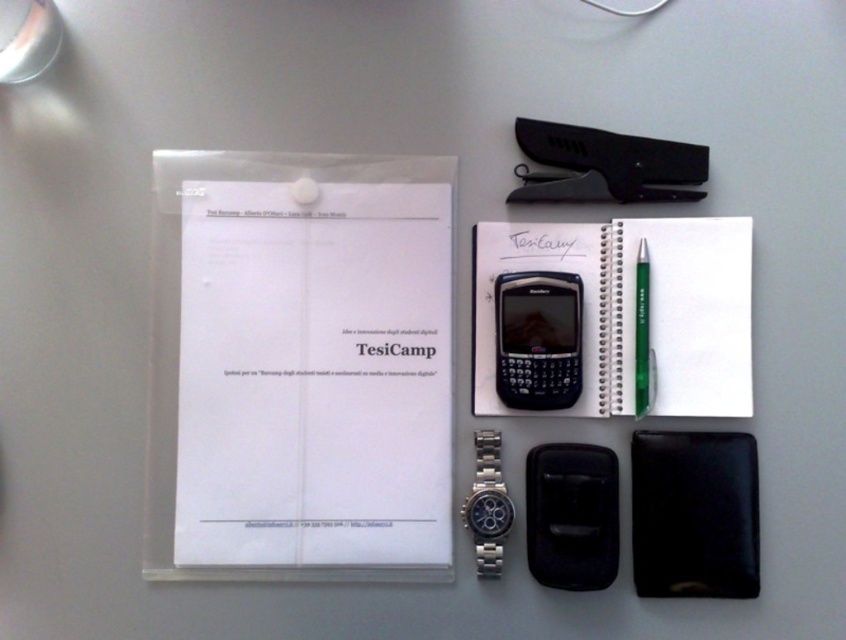
Can you confirm if spiral-bound paper at center is wider than black plastic clipboard at upper center?

Yes.

The image size is (846, 640). What are the coordinates of `spiral-bound paper at center` in the screenshot? It's located at (632, 310).

At what (x,y) coordinates should I click in order to perform the action: click on spiral-bound paper at center. Please return your answer as a coordinate pair (x, y). The width and height of the screenshot is (846, 640). Looking at the image, I should click on (632, 310).

Is spiral-bound paper at center smaller than black leather notepad at center right?

Actually, spiral-bound paper at center might be larger than black leather notepad at center right.

Measure the distance between point (704, 305) and camera.

A distance of 28.41 inches exists between point (704, 305) and camera.

This screenshot has width=846, height=640. What are the coordinates of `spiral-bound paper at center` in the screenshot? It's located at (632, 310).

Where is `spiral-bound paper at center`? spiral-bound paper at center is located at coordinates (632, 310).

Does spiral-bound paper at center appear under black plastic smartphone at center?

No, spiral-bound paper at center is not below black plastic smartphone at center.

Describe the element at coordinates (632, 310) in the screenshot. The height and width of the screenshot is (640, 846). I see `spiral-bound paper at center` at that location.

At what (x,y) coordinates should I click in order to perform the action: click on spiral-bound paper at center. Please return your answer as a coordinate pair (x, y). The image size is (846, 640). Looking at the image, I should click on (632, 310).